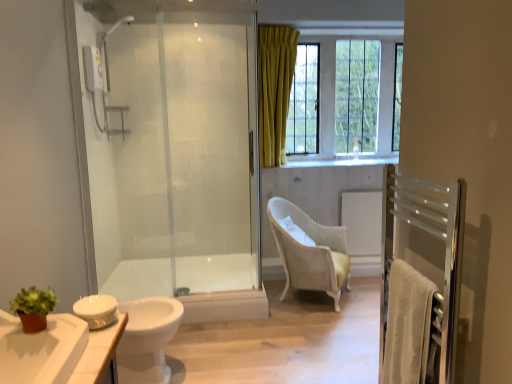
What are the coordinates of `free spot to the right of white glossy faucet at upper center` in the screenshot? It's located at (374, 162).